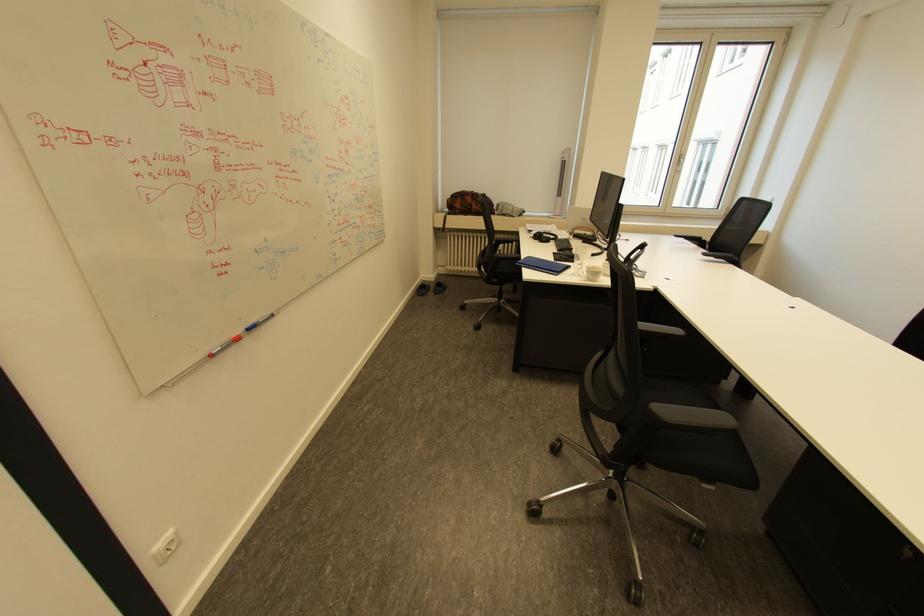
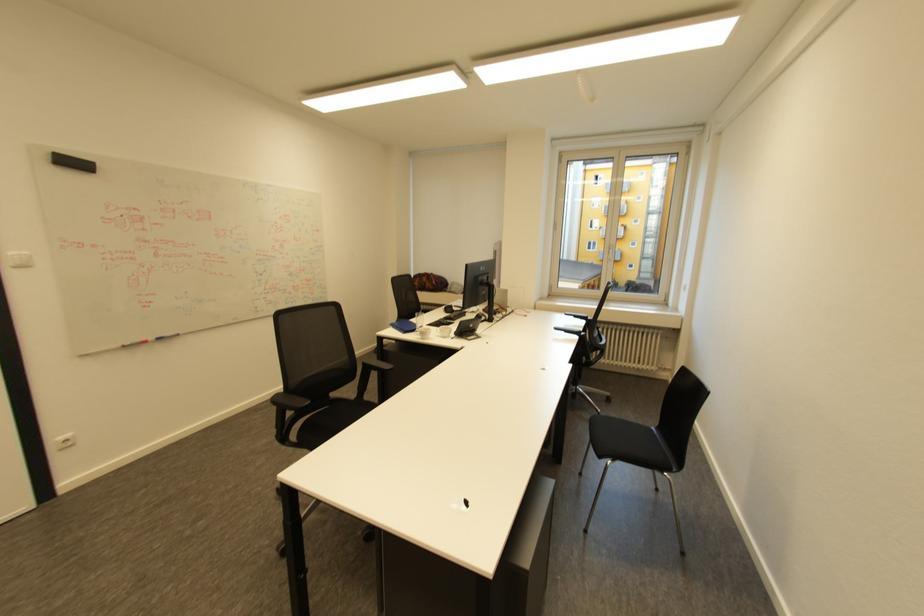
Where in the second image is the point corresponding to pixel 564 273 from the first image?

(411, 331)